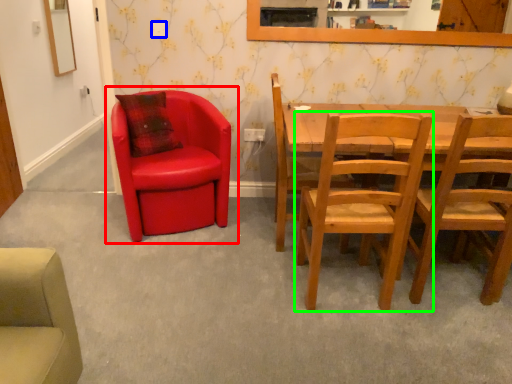
Question: Which object is positioned farthest from chair (highlighted by a red box)? Select from power outlet (highlighted by a blue box) and chair (highlighted by a green box).

Choices:
 (A) power outlet
 (B) chair

Answer: (B)